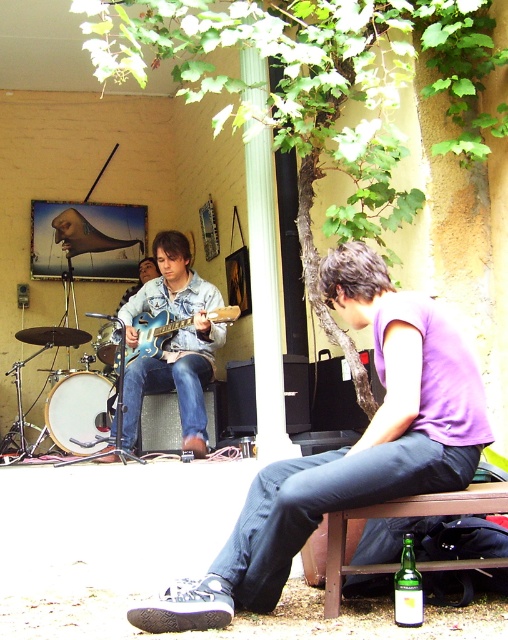
Question: Which object is positioned farthest from the brushed metal drum at center?

Choices:
 (A) matte blue guitar at center
 (B) blue metallic guitar at center
 (C) white drumhead at lower left
 (D) green glass bottle at lower right

Answer: (D)

Question: In this image, where is matte blue guitar at center located relative to green glass bottle at lower right?

Choices:
 (A) left
 (B) right

Answer: (A)

Question: Does white drumhead at lower left have a greater width compared to brushed metal drum at center?

Choices:
 (A) yes
 (B) no

Answer: (A)

Question: Can you confirm if green glass bottle at lower right is positioned below brushed metal drum at center?

Choices:
 (A) yes
 (B) no

Answer: (A)

Question: Which point is farther to the camera?

Choices:
 (A) (47, 429)
 (B) (161, 348)
 (C) (420, 616)
 (D) (206, 362)

Answer: (A)

Question: Based on their relative distances, which object is nearer to the green glass bottle at lower right?

Choices:
 (A) blue metallic guitar at center
 (B) brushed metal drum at center
 (C) white drumhead at lower left
 (D) matte blue guitar at center

Answer: (D)